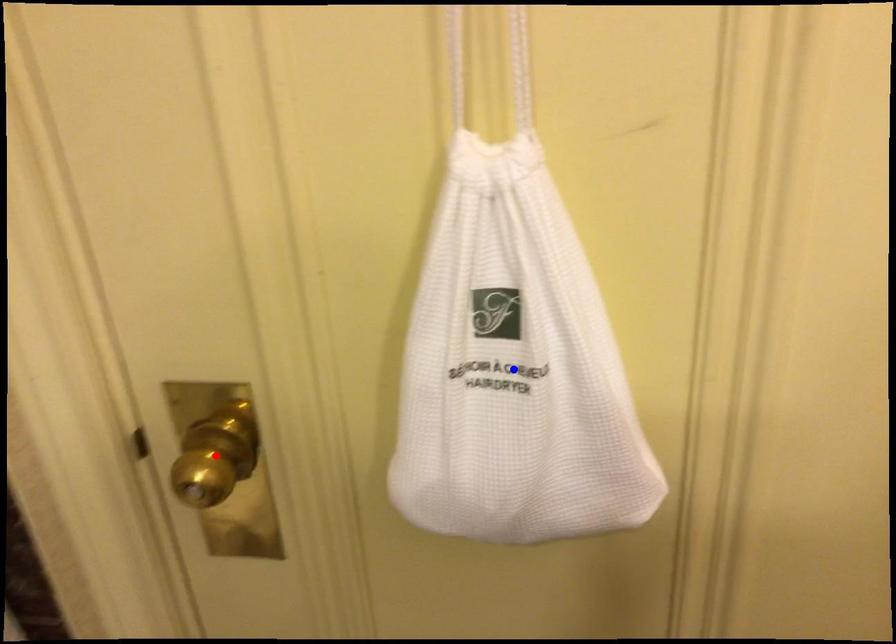
Question: Which of the two points in the image is closer to the camera?

Choices:
 (A) Blue point is closer.
 (B) Red point is closer.

Answer: (A)